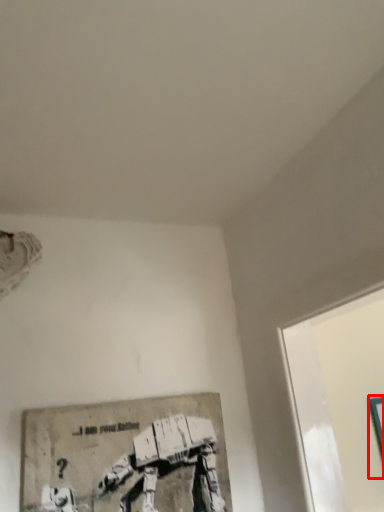
Question: From the image's perspective, where is picture frame (annotated by the red box) located in relation to picture frame in the image?

Choices:
 (A) above
 (B) below

Answer: (B)